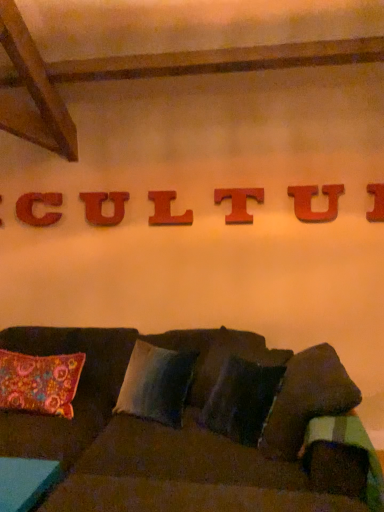
Question: Is wooden letter i at upper center, which ranks as the 7th letter in left-to-right order, thinner than wooden letter c at upper center, acting as the 2th letter starting from the left?

Choices:
 (A) no
 (B) yes

Answer: (B)

Question: Considering the relative sizes of wooden letter i at upper center, which is the 1th letter in right-to-left order, and wooden letter c at upper center, which ranks as the sixth letter in right-to-left order, in the image provided, is wooden letter i at upper center, which is the 1th letter in right-to-left order, wider than wooden letter c at upper center, which ranks as the sixth letter in right-to-left order,?

Choices:
 (A) no
 (B) yes

Answer: (A)

Question: Is wooden letter i at upper center, which ranks as the 7th letter in left-to-right order, closer to camera compared to wooden letter c at upper center, acting as the 2th letter starting from the left?

Choices:
 (A) yes
 (B) no

Answer: (A)

Question: Does wooden letter i at upper center, which is the 1th letter in right-to-left order, appear on the right side of wooden letter c at upper center, which ranks as the sixth letter in right-to-left order?

Choices:
 (A) no
 (B) yes

Answer: (B)

Question: Is wooden letter i at upper center, which is the 1th letter in right-to-left order, next to wooden letter c at upper center, which ranks as the sixth letter in right-to-left order, and touching it?

Choices:
 (A) yes
 (B) no

Answer: (B)

Question: Is wooden letter l at center, which is counted as the fourth letter, starting from the left, spatially inside dark fabric couch at center, or outside of it?

Choices:
 (A) outside
 (B) inside

Answer: (A)

Question: Relative to dark fabric couch at center, is wooden letter l at center, which is counted as the fourth letter, starting from the left, in front or behind?

Choices:
 (A) behind
 (B) front

Answer: (A)

Question: Is point pyautogui.click(x=168, y=198) closer or farther from the camera than point pyautogui.click(x=92, y=478)?

Choices:
 (A) farther
 (B) closer

Answer: (A)

Question: Looking at their shapes, would you say wooden letter l at center, which is counted as the fourth letter, starting from the left, is wider or thinner than dark fabric couch at center?

Choices:
 (A) thin
 (B) wide

Answer: (A)

Question: Is wooden letter l at center, which is counted as the fourth letter, starting from the left, situated inside wooden letter t at center, which appears as the 3th letter when viewed from the right, or outside?

Choices:
 (A) inside
 (B) outside

Answer: (B)

Question: Considering the relative positions of wooden letter l at center, which ranks as the 4th letter in right-to-left order, and wooden letter t at center, which appears as the 3th letter when viewed from the right, in the image provided, is wooden letter l at center, which ranks as the 4th letter in right-to-left order, to the left or to the right of wooden letter t at center, which appears as the 3th letter when viewed from the right,?

Choices:
 (A) left
 (B) right

Answer: (A)

Question: Looking at their shapes, would you say wooden letter l at center, which is counted as the fourth letter, starting from the left, is wider or thinner than wooden letter t at center, which appears as the 3th letter when viewed from the right?

Choices:
 (A) wide
 (B) thin

Answer: (A)

Question: Considering the positions of point (168, 202) and point (243, 189), is point (168, 202) closer or farther from the camera than point (243, 189)?

Choices:
 (A) closer
 (B) farther

Answer: (B)

Question: Does point 190,347 appear closer or farther from the camera than point 226,197?

Choices:
 (A) farther
 (B) closer

Answer: (B)

Question: From a real-world perspective, is dark fabric couch at center positioned above or below wooden letter t at center, which is the 5th letter in left-to-right order?

Choices:
 (A) above
 (B) below

Answer: (B)